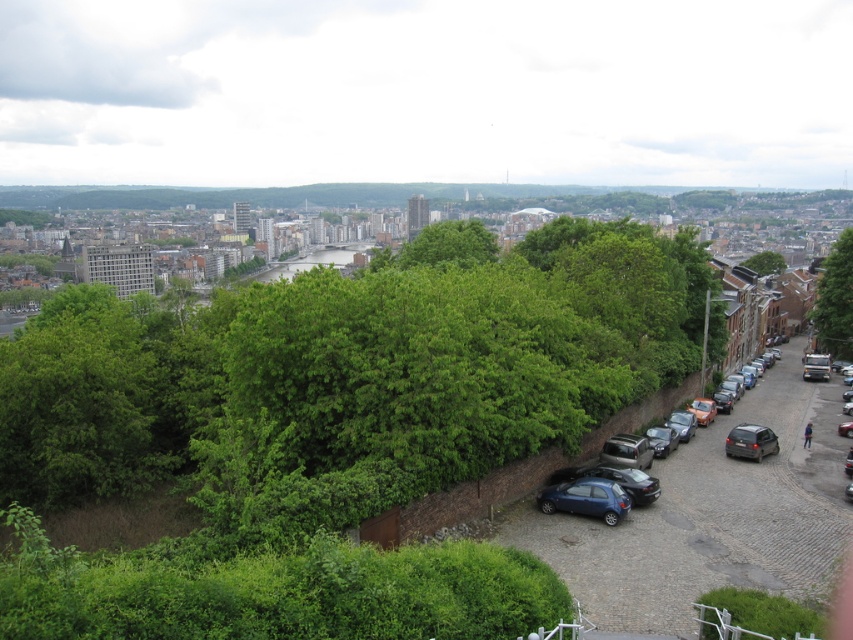
Question: Does green leafy tree at center come in front of matte black car at lower right?

Choices:
 (A) no
 (B) yes

Answer: (B)

Question: Does green leafy tree at right appear under green leafy tree at upper right?

Choices:
 (A) yes
 (B) no

Answer: (A)

Question: Which object appears farthest from the camera in this image?

Choices:
 (A) metallic blue hatchback at center-right
 (B) matte black car at lower right

Answer: (A)

Question: Which of these objects is positioned closest to the matte black car at lower right?

Choices:
 (A) satin black car at lower right
 (B) green leafy tree at right
 (C) green leafy tree at upper right
 (D) metallic blue hatchback at center-right

Answer: (A)

Question: Does matte black car at lower right have a greater width compared to green leafy tree at upper right?

Choices:
 (A) yes
 (B) no

Answer: (B)

Question: Considering the real-world distances, which object is farthest from the green leafy tree at right?

Choices:
 (A) matte black car at lower right
 (B) green leafy tree at upper right
 (C) metallic blue hatchback at center-right
 (D) green leafy tree at center

Answer: (C)